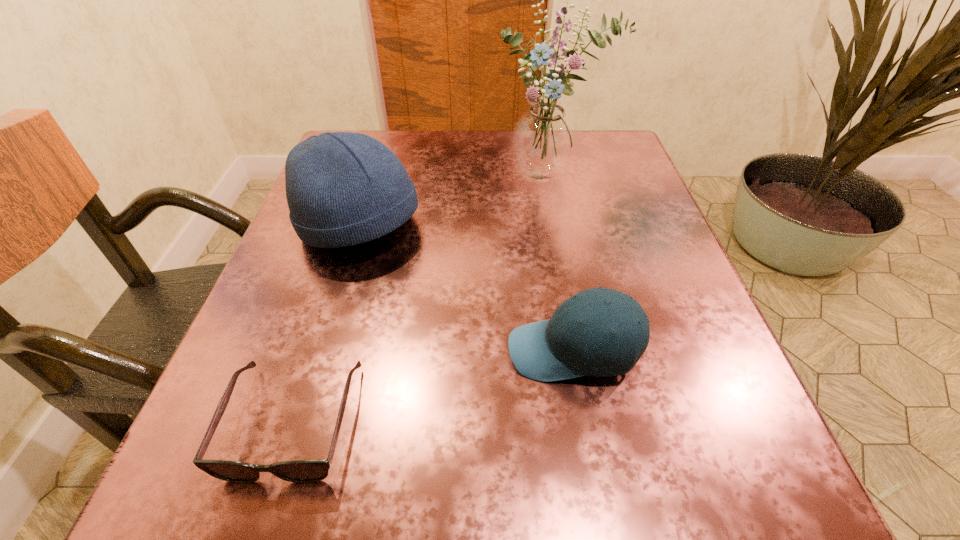
The image size is (960, 540). Identify the location of bouquet. (544, 139).

At what (x,y) coordinates should I click in order to perform the action: click on skullcap. Please return your answer as a coordinate pair (x, y). This screenshot has width=960, height=540. Looking at the image, I should click on (342, 188).

At what (x,y) coordinates should I click in order to perform the action: click on baseball cap. Please return your answer as a coordinate pair (x, y). Looking at the image, I should click on click(x=560, y=348).

I want to click on the shortest object, so click(300, 471).

Identify the location of vacant region located 0.190m on the front-facing side of the bouquet. The height and width of the screenshot is (540, 960). (566, 259).

At what (x,y) coordinates should I click in order to perform the action: click on free space located 0.350m on the right of the second tallest object. Please return your answer as a coordinate pair (x, y). The width and height of the screenshot is (960, 540). Looking at the image, I should click on click(x=604, y=226).

Where is `blank space located 0.110m on the front-facing side of the baseball cap`? blank space located 0.110m on the front-facing side of the baseball cap is located at coordinates (432, 351).

Find the location of a particular element. The image size is (960, 540). vacant space located on the front-facing side of the baseball cap is located at coordinates (383, 351).

Locate an element on the screen. Image resolution: width=960 pixels, height=540 pixels. free location located on the front-facing side of the baseball cap is located at coordinates (245, 351).

The image size is (960, 540). What are the coordinates of `object that is at the far edge` in the screenshot? It's located at (544, 139).